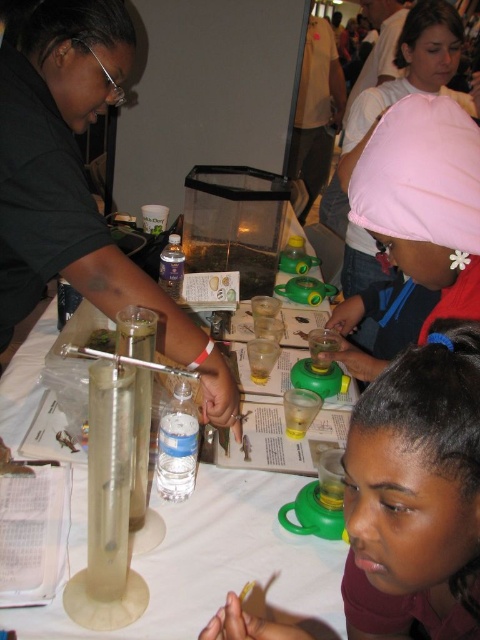
Does matte green plastic cup at center appear on the right side of translucent plastic table at center?

Correct, you'll find matte green plastic cup at center to the right of translucent plastic table at center.

Does point (436, 620) lie in front of point (296, 605)?

Yes.

Does point (352, 628) come behind point (274, 579)?

No, (352, 628) is in front of (274, 579).

What are the coordinates of `matte green plastic cup at center` in the screenshot? It's located at (416, 493).

From the picture: Between translucent plastic table at center and pink fabric cap at upper center, which one has less height?

With less height is pink fabric cap at upper center.

Who is lower down, translucent plastic table at center or pink fabric cap at upper center?

translucent plastic table at center is lower down.

Is point (207, 593) farther from camera compared to point (351, 208)?

Yes, point (207, 593) is farther from viewer.

Identify the location of translucent plastic table at center. The width and height of the screenshot is (480, 640). (220, 561).

Does matte green plastic cup at center come behind pink fabric cap at upper center?

No, matte green plastic cup at center is closer to the viewer.

This screenshot has height=640, width=480. I want to click on matte green plastic cup at center, so click(x=416, y=493).